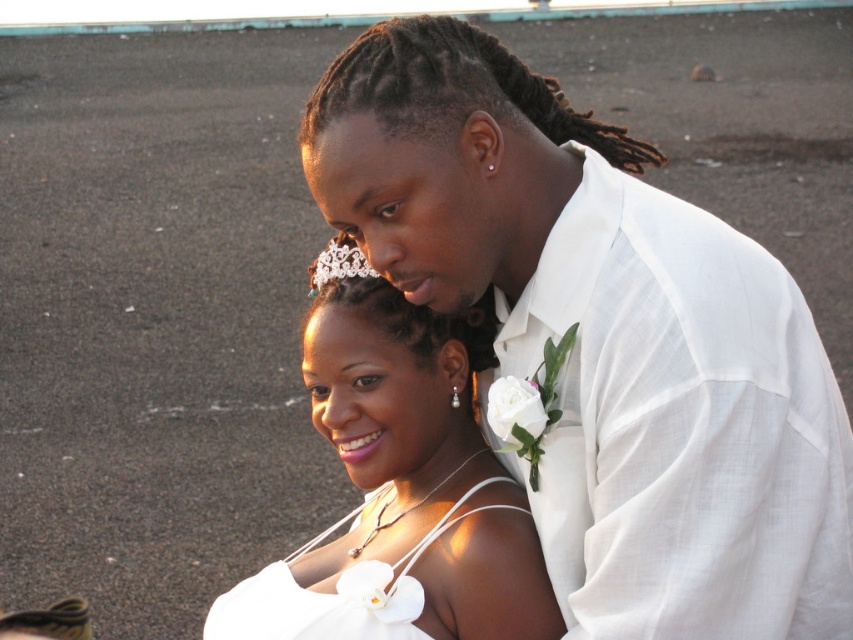
You are a photographer at a wedding venue. You need to decide which dress to adjust the lighting for based on their sizes. The white satin dress at center and the white satin dress at lower center are both in your frame. Which dress requires more lighting adjustment due to its larger size?

The white satin dress at center requires more lighting adjustment because it is wider than the white satin dress at lower center, making it larger and needing more focused lighting.

Based on the coordinates provided, which object is located at point (401,490) in the image?

The point (401,490) corresponds to the white satin dress at center.

You are a photographer at a wedding. You need to adjust your focus to capture both the floral accessory at the bride neckline and the boutonniere on the other person. The floral accessory is at point (x=761, y=472) and the boutonniere is at point (x=314, y=276). Which point should you focus on first to ensure the closer object is sharp?

Point (x=761, y=472) is closer to the camera than point (x=314, y=276), so you should focus on point (x=761, y=472) first to ensure the closer object is sharp.